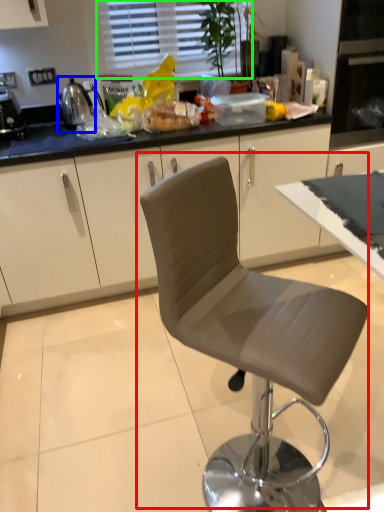
Question: Estimate the real-world distances between objects in this image. Which object is closer to chair (highlighted by a red box), appliance (highlighted by a blue box) or window (highlighted by a green box)?

Choices:
 (A) appliance
 (B) window

Answer: (A)